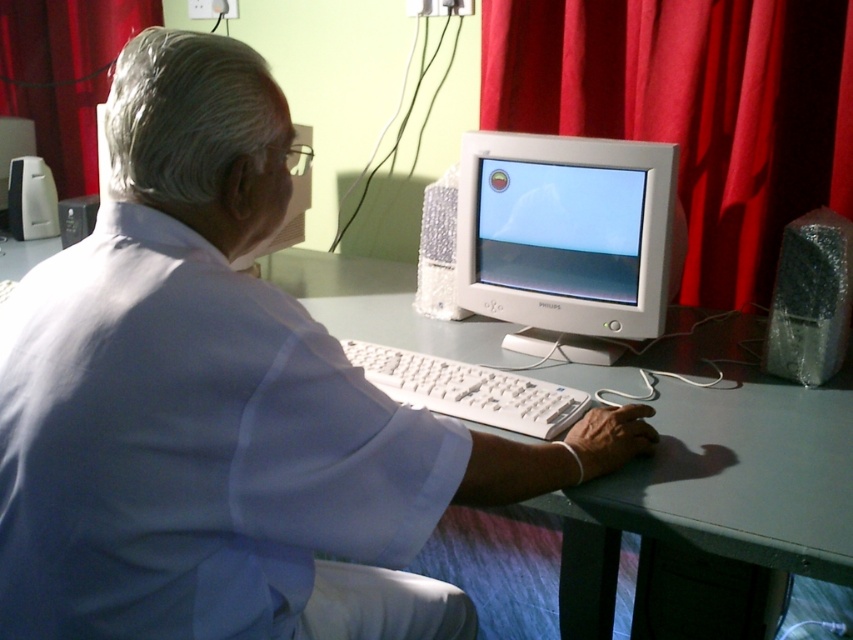
Question: Is matte plastic monitor at center wider than white plastic keyboard at center?

Choices:
 (A) no
 (B) yes

Answer: (A)

Question: Which object is the farthest from the white plastic monitor at center?

Choices:
 (A) white plastic keyboard at center
 (B) red fabric curtain at upper left
 (C) red fabric curtain at upper center

Answer: (B)

Question: Can you confirm if red fabric curtain at upper center is bigger than white plastic monitor at center?

Choices:
 (A) no
 (B) yes

Answer: (B)

Question: Does white plastic monitor at center have a smaller size compared to matte plastic monitor at center?

Choices:
 (A) no
 (B) yes

Answer: (A)

Question: Which of these objects is positioned closest to the white plastic monitor at center?

Choices:
 (A) white plastic desktop computer at left
 (B) red fabric curtain at upper left
 (C) white matte shirt at center

Answer: (C)

Question: Which point is farther from the camera taking this photo?

Choices:
 (A) (492, 371)
 (B) (730, 164)
 (C) (93, 20)

Answer: (C)